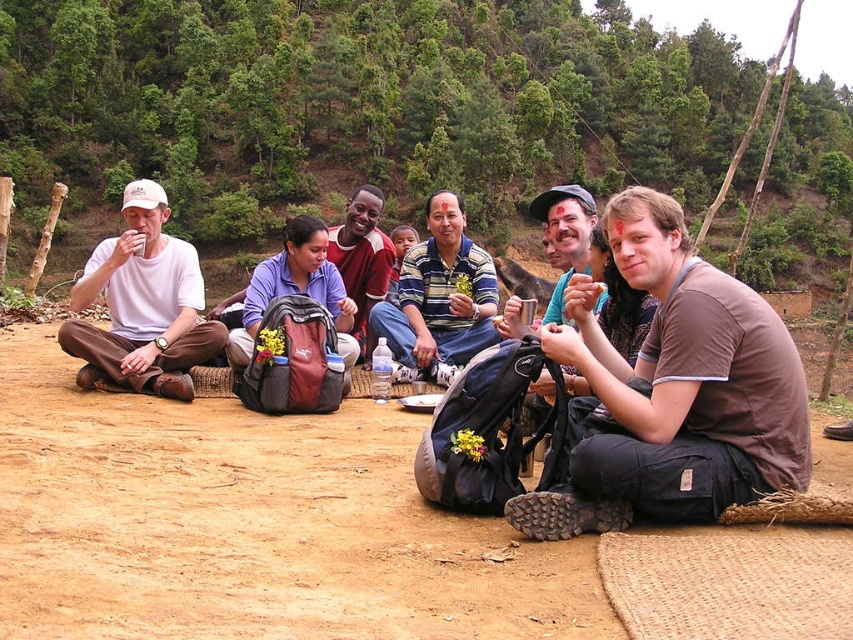
You are part of the group sitting on the woven mats. You need to pass a snack to the person wearing the blue fabric shirt at center. Which direction should you move to reach them from the matte white shirt at left?

The matte white shirt at left is positioned on the left side of the blue fabric shirt at center, so you should move to the right to reach them.

You are part of the group sitting on the woven mats. You notice the matte white shirt at left and the blue fabric shirt at center. Which shirt is closer to the ground?

The matte white shirt at left is located below the blue fabric shirt at center, so it is closer to the ground.

Where is the brown cotton shirt at center located in the image?

The brown cotton shirt at center is located at point (x=671, y=392).